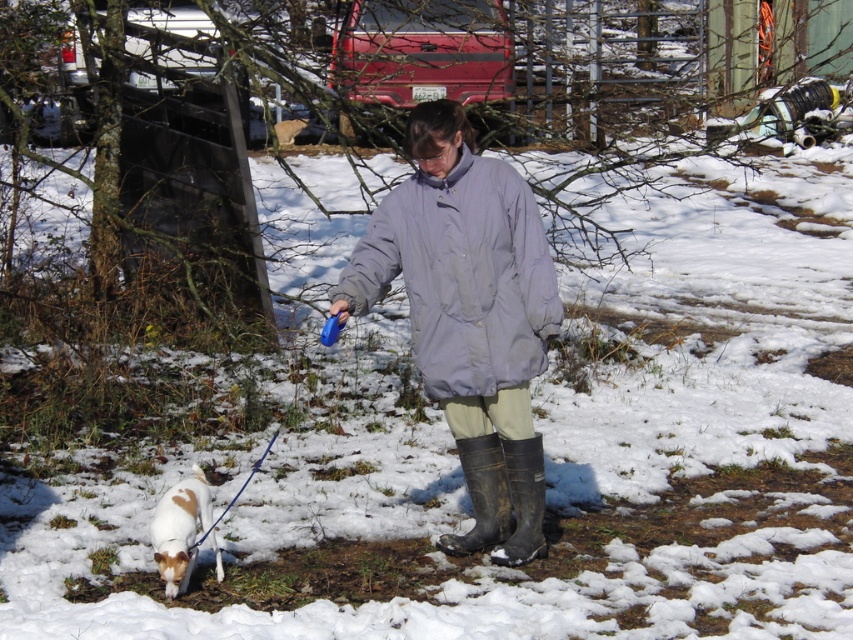
Question: Among these points, which one is nearest to the camera?

Choices:
 (A) (537, 490)
 (B) (152, 534)
 (C) (450, 307)

Answer: (B)

Question: Considering the real-world distances, which object is closest to the brown and white fur at lower left?

Choices:
 (A) black rubber boot at lower center
 (B) matte gray jacket at center
 (C) rubber/matte boot at lower center

Answer: (A)

Question: Is black rubber boot at lower center behind rubber/matte boot at lower center?

Choices:
 (A) no
 (B) yes

Answer: (B)

Question: Does matte gray jacket at center have a lesser width compared to brown and white fur at lower left?

Choices:
 (A) no
 (B) yes

Answer: (A)

Question: Which object is positioned closest to the black rubber boot at lower center?

Choices:
 (A) rubber/matte boot at lower center
 (B) brown and white fur at lower left

Answer: (A)

Question: Is brown and white fur at lower left bigger than rubber/matte boot at lower center?

Choices:
 (A) yes
 (B) no

Answer: (A)